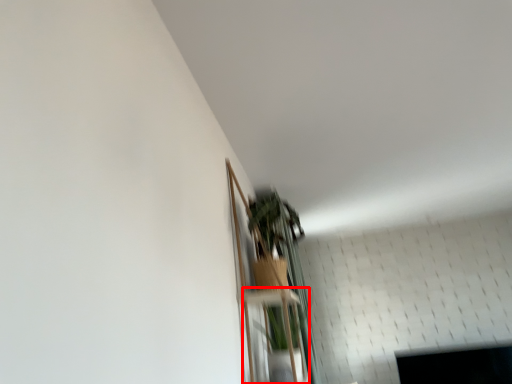
Question: From the image's perspective, where is shelf (annotated by the red box) located relative to shelf?

Choices:
 (A) below
 (B) above

Answer: (A)